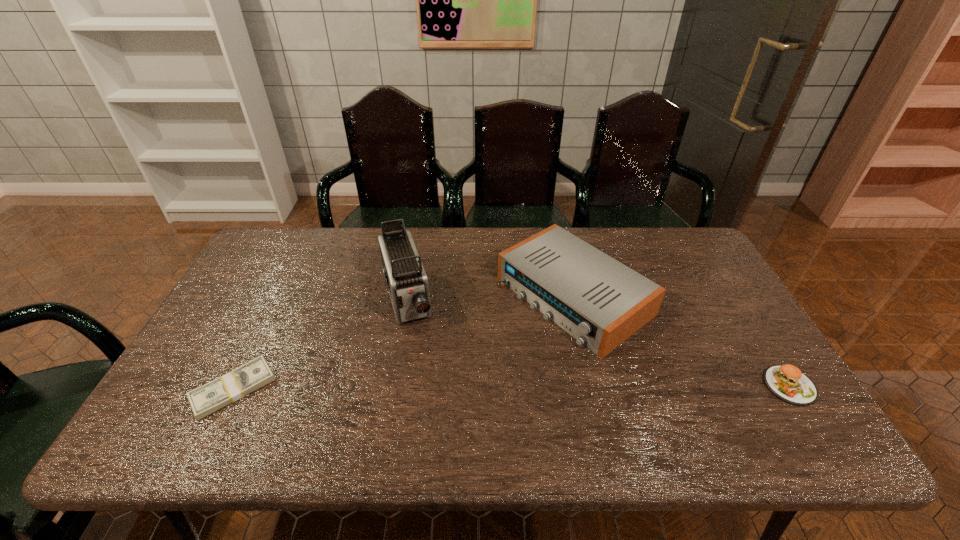
You are a GUI agent. You are given a task and a screenshot of the screen. Output one action in this format:
    pyautogui.click(x=<x>, y=<y>)
    Task: Click on the shortest object
    Image resolution: width=960 pixels, height=540 pixels.
    Given the screenshot: What is the action you would take?
    pyautogui.click(x=204, y=400)

Where is `the leftmost object`? the leftmost object is located at coordinates (204, 400).

Locate an element on the screen. Image resolution: width=960 pixels, height=540 pixels. the third tallest object is located at coordinates (787, 382).

Locate an element on the screen. patty is located at coordinates (787, 382).

Find the location of a particular element. The height and width of the screenshot is (540, 960). the second object from right to left is located at coordinates (601, 302).

Identify the location of the second tallest object. (601, 302).

At what (x,y) coordinates should I click in order to perform the action: click on camcorder. Please return your answer as a coordinate pair (x, y). Looking at the image, I should click on (406, 280).

Where is `the third object from right to left`? the third object from right to left is located at coordinates (406, 280).

Where is `free spot located 0.260m on the right of the leftmost object`? free spot located 0.260m on the right of the leftmost object is located at coordinates (379, 389).

Image resolution: width=960 pixels, height=540 pixels. Find the location of `blank area located 0.320m on the left of the patty`. blank area located 0.320m on the left of the patty is located at coordinates (636, 386).